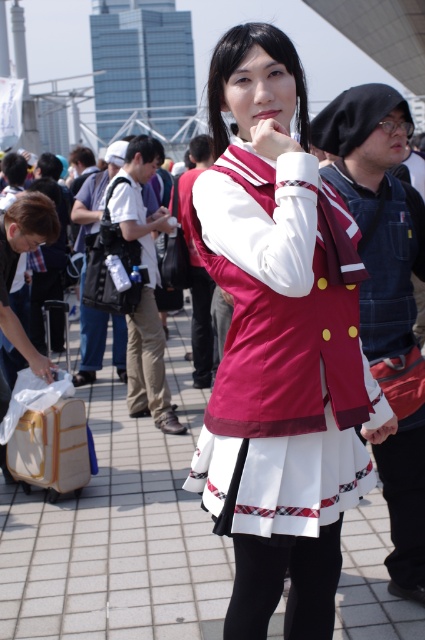
Question: Among these points, which one is farthest from the camera?

Choices:
 (A) (297, 586)
 (B) (288, 330)
 (C) (70, 404)

Answer: (C)

Question: Which object is closer to the camera taking this photo?

Choices:
 (A) wooden suitcase at lower left
 (B) matte red vest at center
 (C) white fabric skirt at center

Answer: (B)

Question: Does white fabric skirt at center have a lesser width compared to wooden suitcase at lower left?

Choices:
 (A) yes
 (B) no

Answer: (A)

Question: Estimate the real-world distances between objects in this image. Which object is closer to the wooden suitcase at lower left?

Choices:
 (A) white fabric skirt at center
 (B) matte red vest at center

Answer: (A)

Question: Can you confirm if matte red vest at center is thinner than wooden suitcase at lower left?

Choices:
 (A) yes
 (B) no

Answer: (B)

Question: Can you confirm if matte red vest at center is smaller than wooden suitcase at lower left?

Choices:
 (A) yes
 (B) no

Answer: (B)